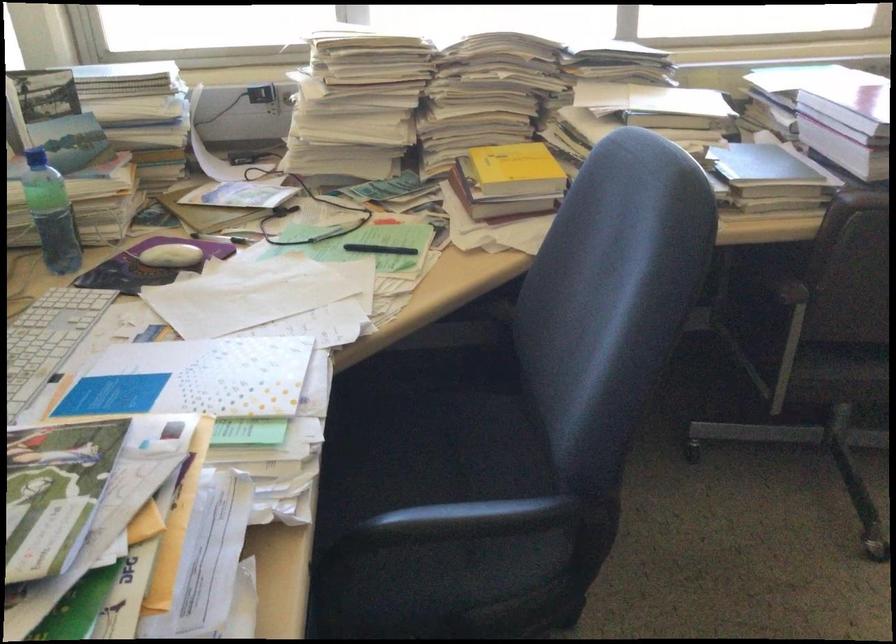
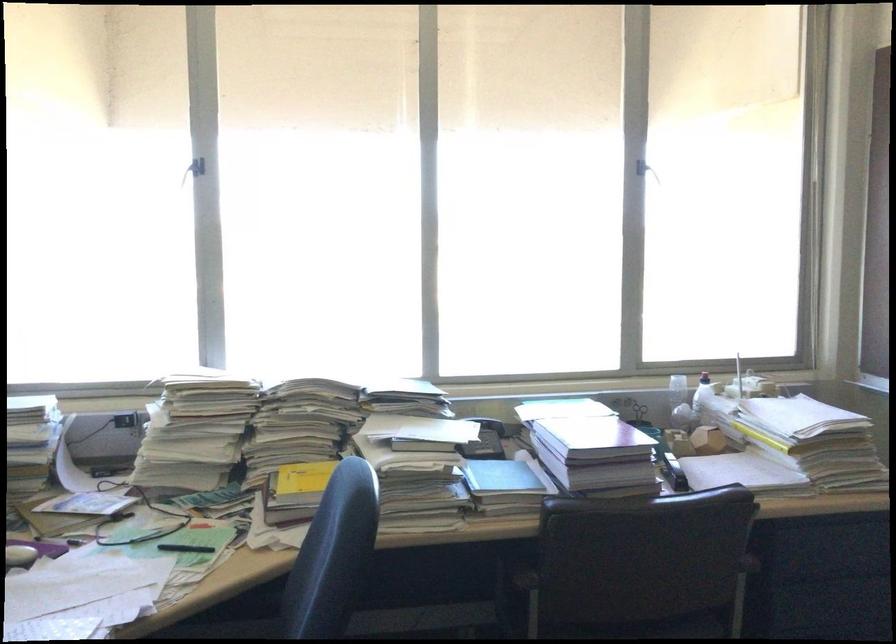
Locate, in the second image, the point that corresponds to the point at 710,120 in the first image.

(485, 440)